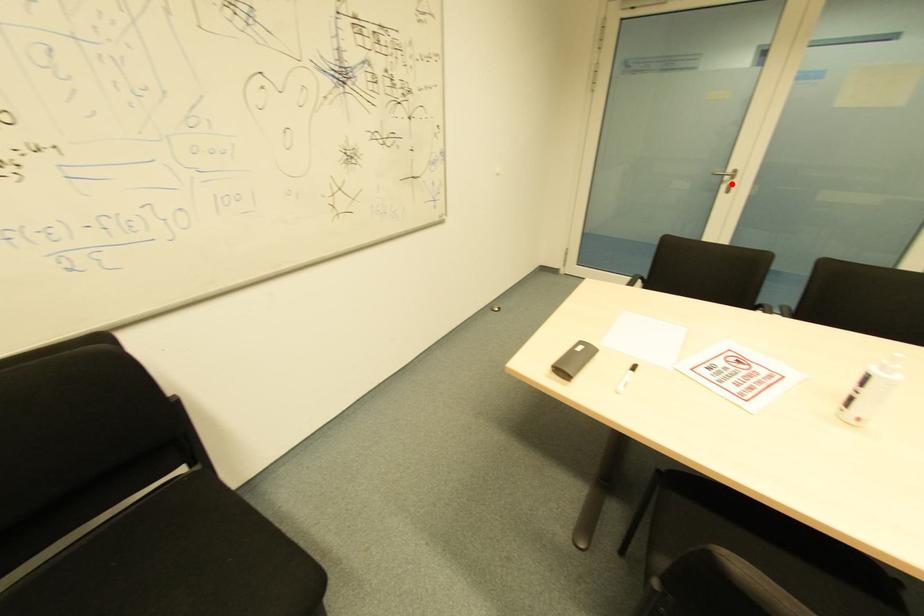
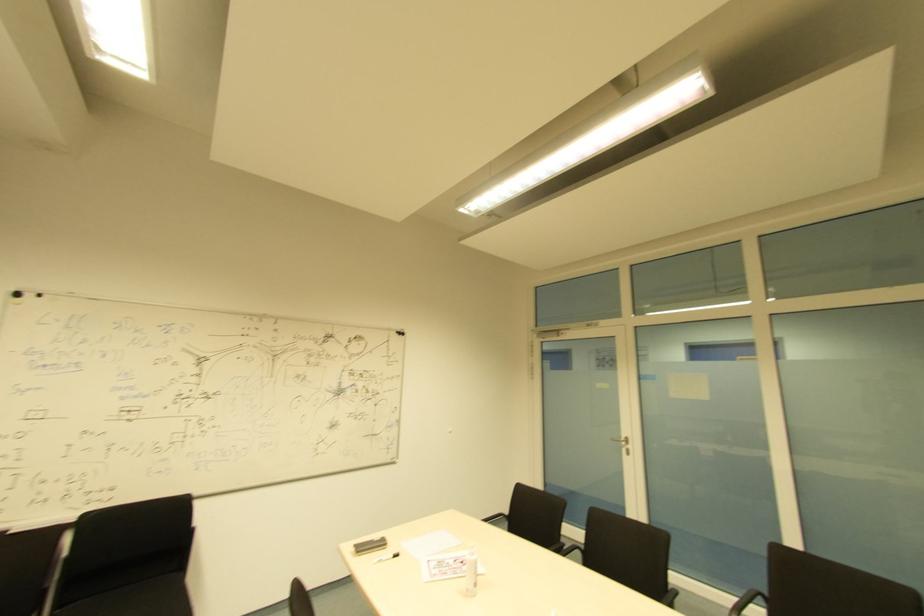
The point at the highlighted location is marked in the first image. Where is the corresponding point in the second image?

(628, 450)